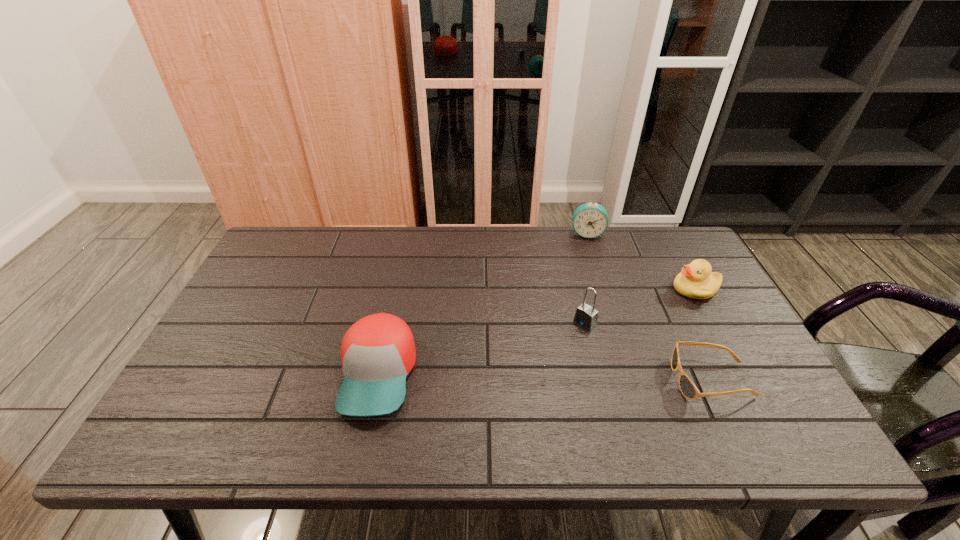
Where is `free space that satisfies the following two spatial constraints: 1. at the brim of the shortest object; 2. on the front-facing side of the baseball cap`? The width and height of the screenshot is (960, 540). free space that satisfies the following two spatial constraints: 1. at the brim of the shortest object; 2. on the front-facing side of the baseball cap is located at coordinates (x=377, y=380).

The height and width of the screenshot is (540, 960). I want to click on vacant space that satisfies the following two spatial constraints: 1. on the front side of the sunglasses; 2. on the front-facing side of the farthest object, so click(633, 380).